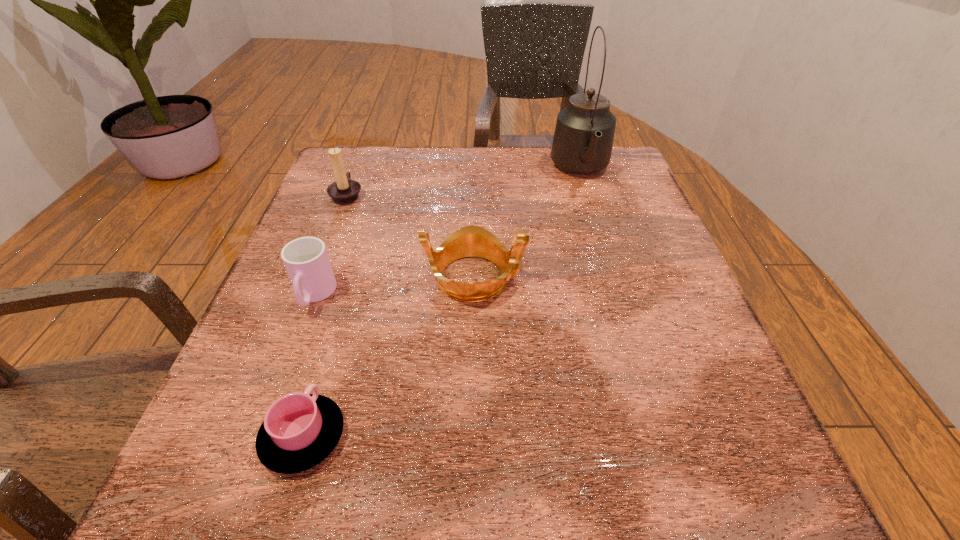
Where is `object at the far left corner`? The image size is (960, 540). object at the far left corner is located at coordinates (344, 190).

Where is `object situated at the near left corner`? The width and height of the screenshot is (960, 540). object situated at the near left corner is located at coordinates (300, 430).

In order to click on object present at the far right corner in this screenshot , I will do `click(583, 139)`.

The image size is (960, 540). What are the coordinates of `free spot at the far edge of the desktop` in the screenshot? It's located at (456, 176).

Where is `vacant region at the near edge of the desktop`? Image resolution: width=960 pixels, height=540 pixels. vacant region at the near edge of the desktop is located at coordinates (511, 510).

Where is `vacant space at the left edge of the desktop`? vacant space at the left edge of the desktop is located at coordinates (274, 340).

At what (x,y) coordinates should I click in order to perform the action: click on vacant space at the right edge of the desktop. Please return your answer as a coordinate pair (x, y). This screenshot has width=960, height=540. Looking at the image, I should click on 612,200.

Locate an element on the screen. The width and height of the screenshot is (960, 540). free point at the far left corner is located at coordinates (388, 178).

I want to click on vacant space at the far right corner of the desktop, so click(612, 171).

Locate an element on the screen. Image resolution: width=960 pixels, height=540 pixels. empty space between the kettle and the candle holder is located at coordinates (464, 183).